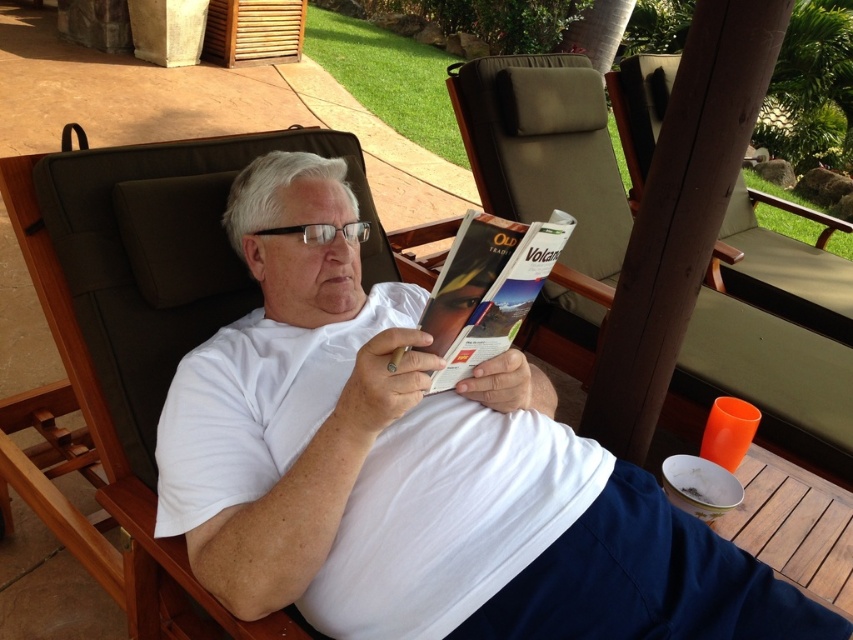
Question: Based on their relative distances, which object is nearer to the matte paper magazine at center?

Choices:
 (A) white matte shirt at center
 (B) brown fabric rocking chair at center

Answer: (A)

Question: Is white matte shirt at center further to camera compared to brown fabric beach chair at center?

Choices:
 (A) yes
 (B) no

Answer: (B)

Question: Is white matte shirt at center positioned behind matte paper magazine at center?

Choices:
 (A) no
 (B) yes

Answer: (B)

Question: Estimate the real-world distances between objects in this image. Which object is closer to the brown fabric rocking chair at center?

Choices:
 (A) white matte shirt at center
 (B) brown fabric beach chair at center
 (C) matte paper magazine at center

Answer: (B)

Question: Can you confirm if brown fabric rocking chair at center is positioned to the right of matte paper magazine at center?

Choices:
 (A) yes
 (B) no

Answer: (A)

Question: Estimate the real-world distances between objects in this image. Which object is farther from the matte paper magazine at center?

Choices:
 (A) white matte shirt at center
 (B) brown fabric beach chair at center
 (C) brown fabric rocking chair at center

Answer: (C)